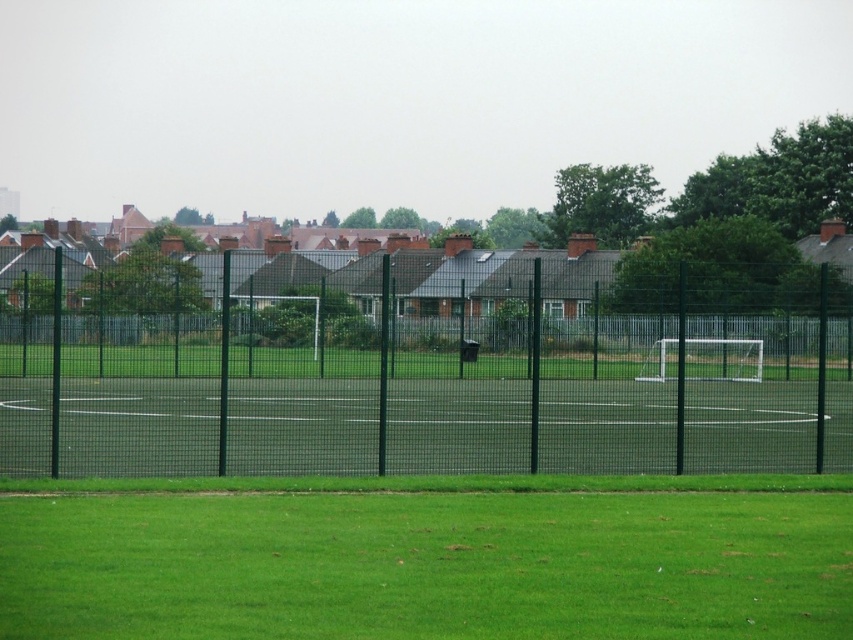
Question: Is green mesh fence at center above green grass at lower center?

Choices:
 (A) no
 (B) yes

Answer: (B)

Question: Which point is farther to the camera?

Choices:
 (A) (42, 508)
 (B) (142, 273)

Answer: (B)

Question: Among these objects, which one is nearest to the camera?

Choices:
 (A) green mesh fence at center
 (B) green grass at lower center

Answer: (B)

Question: Is green mesh fence at center positioned at the back of green grass at lower center?

Choices:
 (A) yes
 (B) no

Answer: (A)

Question: Does green mesh fence at center have a larger size compared to green grass at lower center?

Choices:
 (A) no
 (B) yes

Answer: (B)